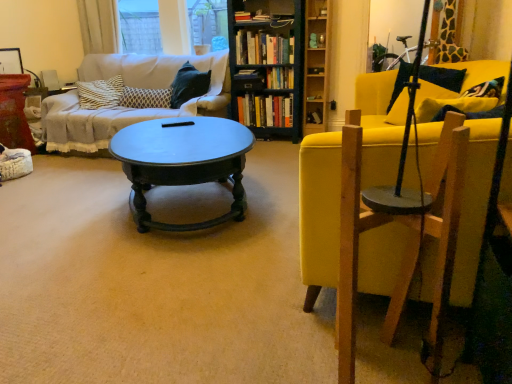
Question: From a real-world perspective, is hardcover books at center, which is counted as the 5th book, starting from the top, located higher than wooden bookshelf at center?

Choices:
 (A) yes
 (B) no

Answer: (B)

Question: From the image's perspective, is hardcover books at center, which is counted as the 5th book, starting from the top, on wooden bookshelf at center?

Choices:
 (A) no
 (B) yes

Answer: (A)

Question: Is hardcover books at center, which is the 2th book from bottom to top, positioned with its back to wooden bookshelf at center?

Choices:
 (A) no
 (B) yes

Answer: (B)

Question: Considering the relative positions of hardcover books at center, which is the 2th book from bottom to top, and wooden bookshelf at center in the image provided, is hardcover books at center, which is the 2th book from bottom to top, to the right of wooden bookshelf at center from the viewer's perspective?

Choices:
 (A) no
 (B) yes

Answer: (A)

Question: Is wooden bookshelf at center inside hardcover books at center, which is the 2th book from bottom to top?

Choices:
 (A) no
 (B) yes

Answer: (A)

Question: Considering the relative sizes of hardcover books at center, which is counted as the 5th book, starting from the top, and wooden bookshelf at center in the image provided, is hardcover books at center, which is counted as the 5th book, starting from the top, taller than wooden bookshelf at center?

Choices:
 (A) yes
 (B) no

Answer: (B)

Question: Is the depth of shiny dark wood coffee table at center greater than that of transparent glass window at upper center?

Choices:
 (A) no
 (B) yes

Answer: (A)

Question: Is shiny dark wood coffee table at center turned away from transparent glass window at upper center?

Choices:
 (A) yes
 (B) no

Answer: (B)

Question: Is shiny dark wood coffee table at center not close to transparent glass window at upper center?

Choices:
 (A) yes
 (B) no

Answer: (A)

Question: Is transparent glass window at upper center a part of shiny dark wood coffee table at center?

Choices:
 (A) no
 (B) yes

Answer: (A)

Question: From the image's perspective, is shiny dark wood coffee table at center located above transparent glass window at upper center?

Choices:
 (A) yes
 (B) no

Answer: (B)

Question: Does shiny dark wood coffee table at center have a larger size compared to transparent glass window at upper center?

Choices:
 (A) yes
 (B) no

Answer: (A)

Question: Is patterned fabric pillow at center-left beside wooden swivel chair at right?

Choices:
 (A) yes
 (B) no

Answer: (B)